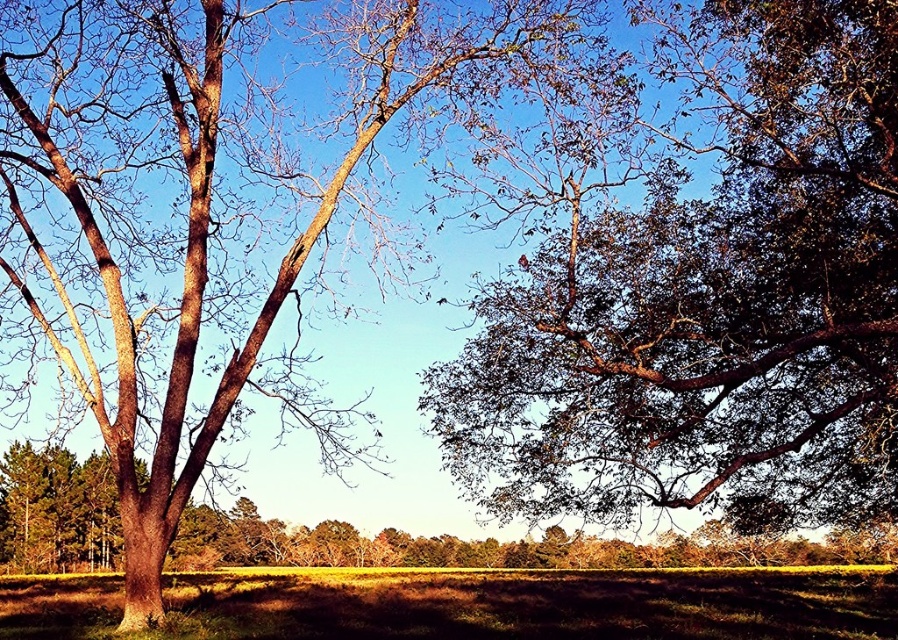
Can you confirm if green leafy tree at upper right is positioned to the right of smooth brown oak tree at upper right?

Yes, green leafy tree at upper right is to the right of smooth brown oak tree at upper right.

Is point (782, 262) more distant than point (110, 157)?

No, (782, 262) is closer to viewer.

Is point (590, 368) positioned before point (339, 419)?

Yes.

You are a GUI agent. You are given a task and a screenshot of the screen. Output one action in this format:
    pyautogui.click(x=<x>, y=<y>)
    Task: Click on the green leafy tree at upper right
    The width and height of the screenshot is (898, 640).
    Given the screenshot: What is the action you would take?
    pyautogui.click(x=709, y=300)

Is green leafy tree at upper right taller than brown rough bark tree at left?

No, green leafy tree at upper right is not taller than brown rough bark tree at left.

Between green leafy tree at upper right and brown rough bark tree at left, which one appears on the right side from the viewer's perspective?

Positioned to the right is green leafy tree at upper right.

The image size is (898, 640). Find the location of `green leafy tree at upper right`. green leafy tree at upper right is located at coordinates (709, 300).

Identify the location of green leafy tree at upper right. This screenshot has width=898, height=640. (709, 300).

Does smooth brown oak tree at upper right appear on the left side of brown rough bark tree at left?

Yes, smooth brown oak tree at upper right is to the left of brown rough bark tree at left.

Does smooth brown oak tree at upper right come behind brown rough bark tree at left?

No, it is not.

Where is `smooth brown oak tree at upper right`? This screenshot has height=640, width=898. smooth brown oak tree at upper right is located at coordinates coord(213,204).